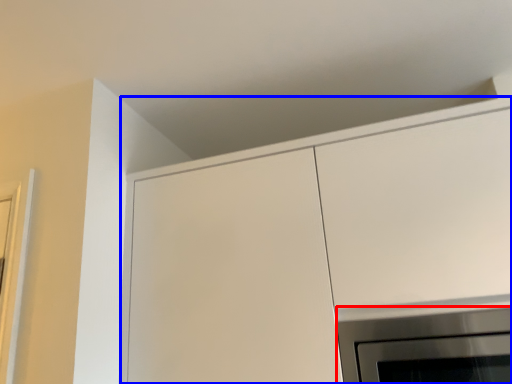
Question: Which of the following is the closest to the observer, appliance (highlighted by a red box) or cabinetry (highlighted by a blue box)?

Choices:
 (A) appliance
 (B) cabinetry

Answer: (B)